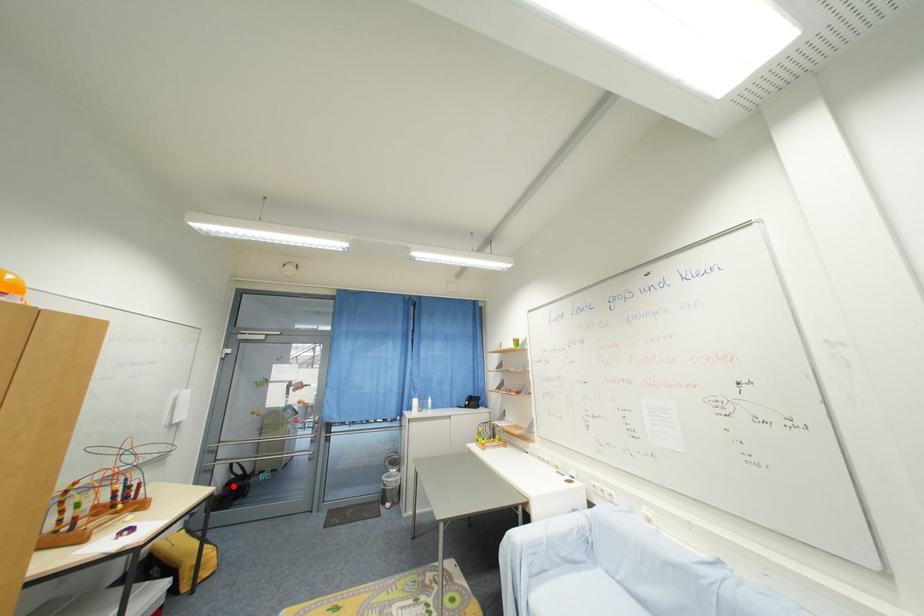
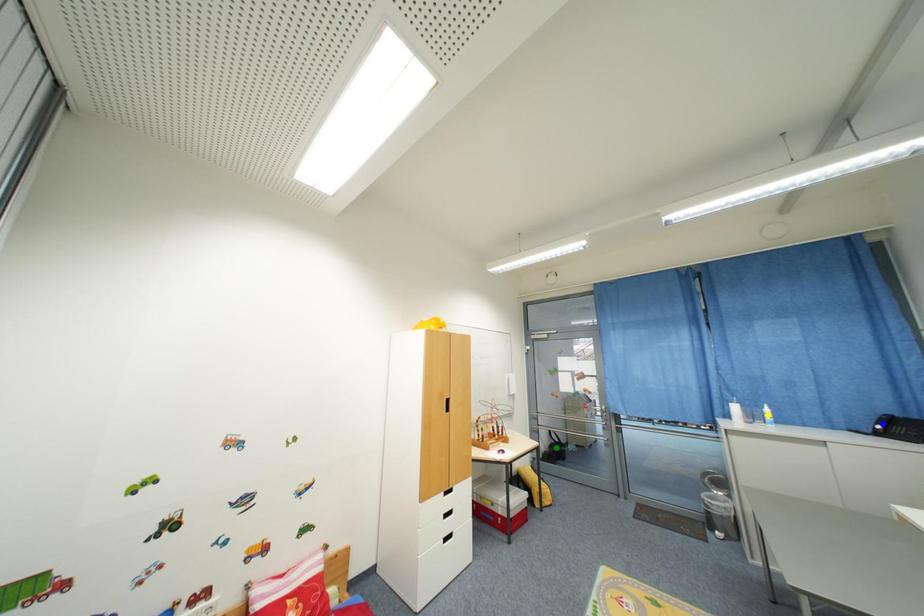
Question: I am providing you with two images of the same scene from different viewpoints. A red point is marked on the first image. You are given multiple points on the second image. Which spot in image 2 lines up with the point in image 1?

Choices:
 (A) blue point
 (B) green point
 (C) yellow point

Answer: (B)